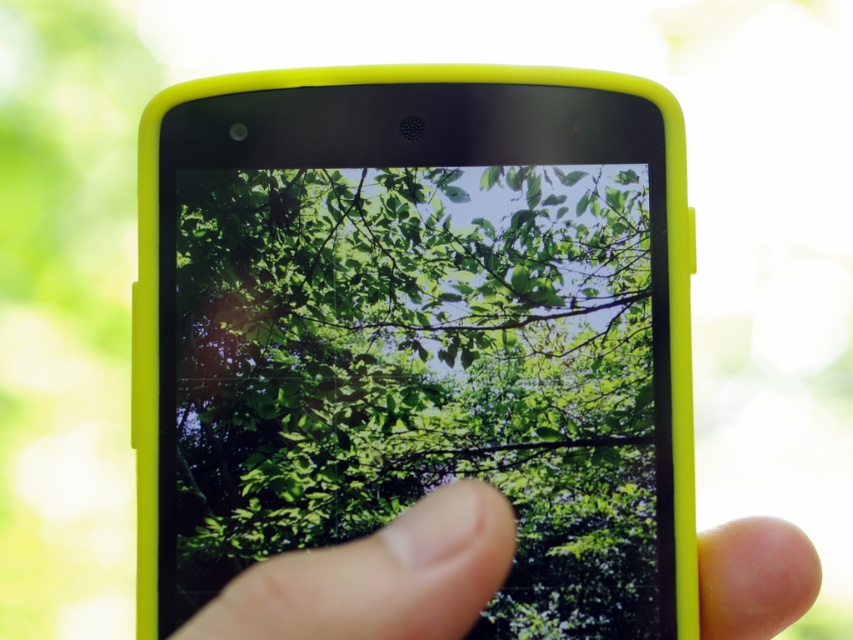
Between green leafy tree at center and finger at center, which one appears on the right side from the viewer's perspective?

finger at center

Is green leafy tree at center to the left of finger at center from the viewer's perspective?

Correct, you'll find green leafy tree at center to the left of finger at center.

Who is more distant from viewer, (635,364) or (778,522)?

Positioned behind is point (635,364).

Find the location of `green leafy tree at center`. green leafy tree at center is located at coordinates (422, 372).